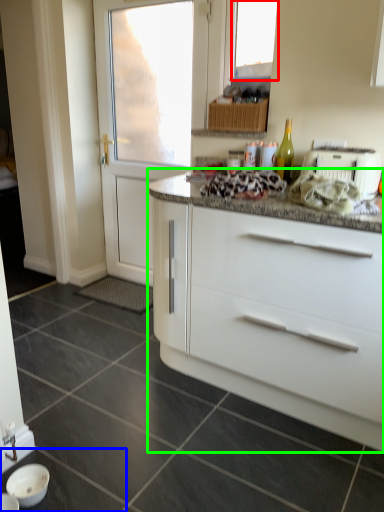
Question: Which object is positioned farthest from window (highlighted by a red box)? Select from tile (highlighted by a blue box) and cabinetry (highlighted by a green box).

Choices:
 (A) tile
 (B) cabinetry

Answer: (A)